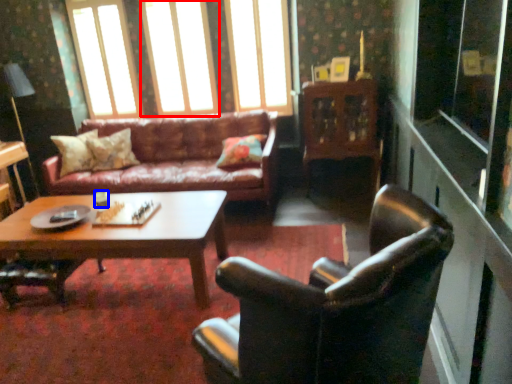
Question: Among these objects, which one is farthest to the camera, window (highlighted by a red box) or coffee cup (highlighted by a blue box)?

Choices:
 (A) window
 (B) coffee cup

Answer: (A)